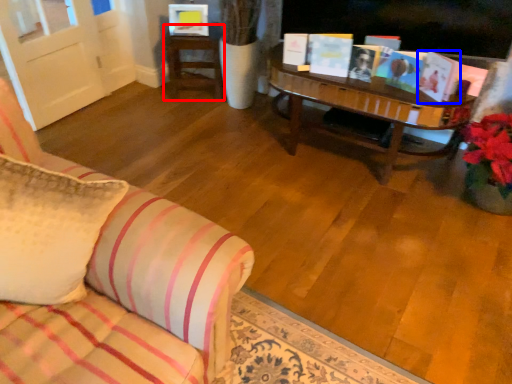
Question: Which point is further to the camera, table (highlighted by a red box) or book (highlighted by a blue box)?

Choices:
 (A) table
 (B) book

Answer: (A)